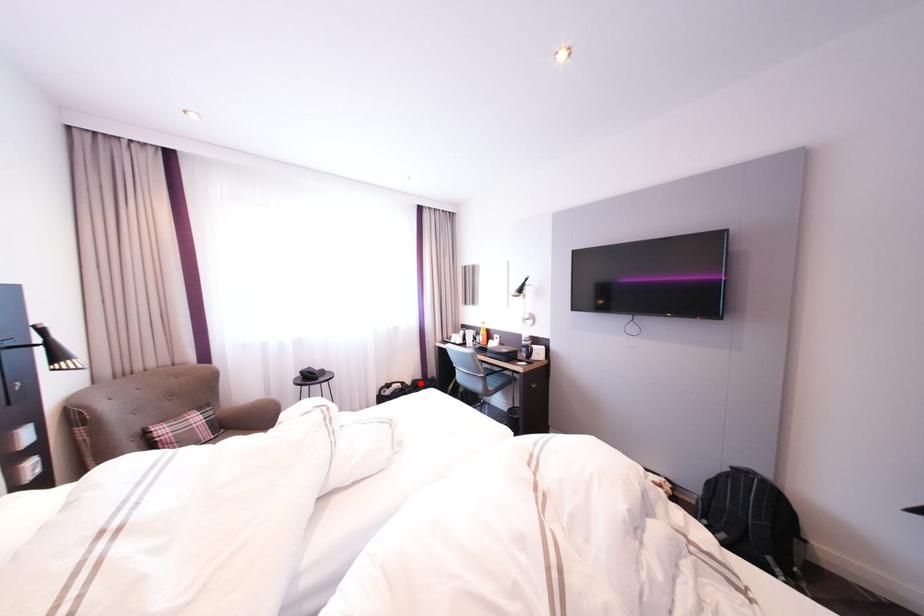
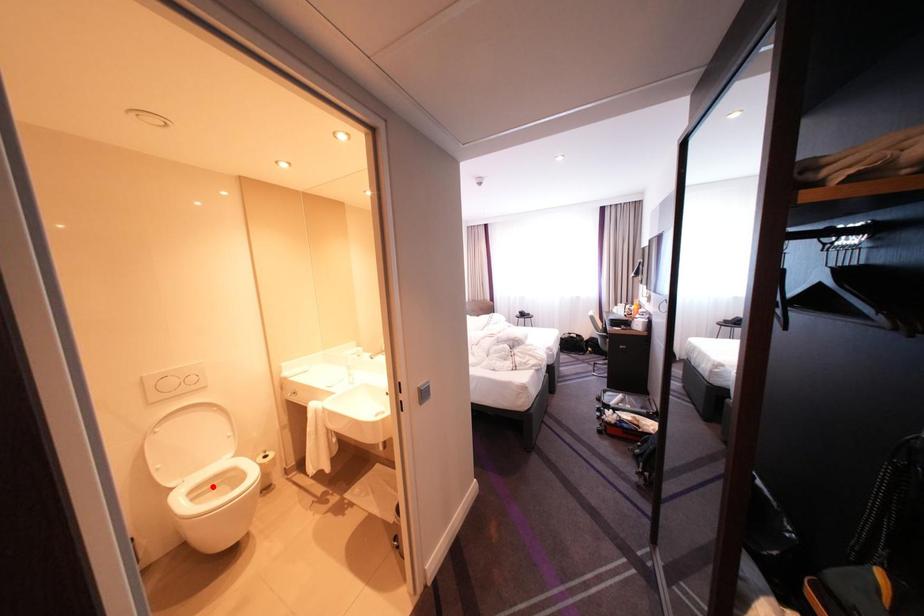
I am providing you with two images of the same scene from different viewpoints. A red point is marked on the first image and another point is marked on the second image. Does the point marked in image1 correspond to the same location as the one in image2?

No